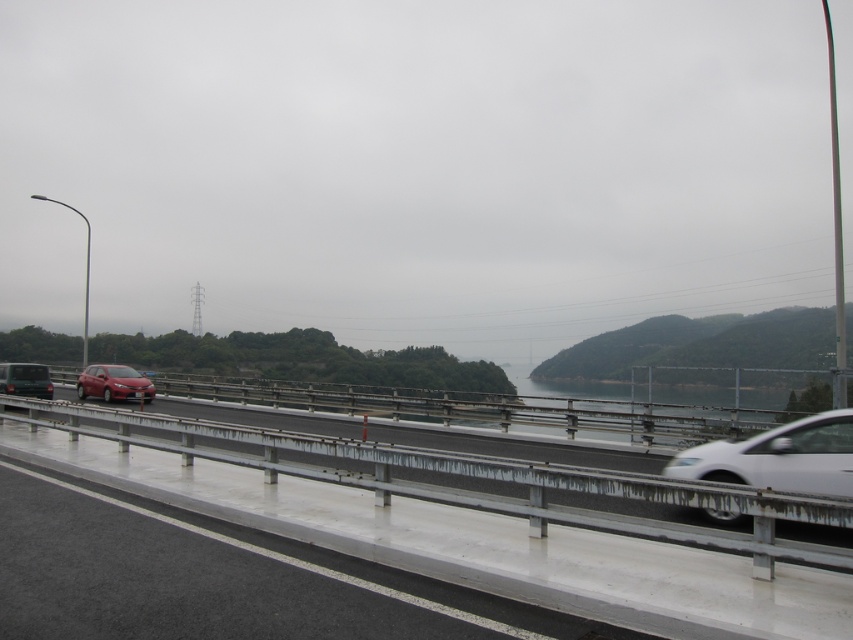
Question: Does white concrete barrier at center appear over shiny red sedan at center?

Choices:
 (A) no
 (B) yes

Answer: (B)

Question: Does white concrete barrier at center have a greater width compared to shiny red sedan at center?

Choices:
 (A) yes
 (B) no

Answer: (B)

Question: Which point is farther to the camera?

Choices:
 (A) matte black car at left
 (B) satin silver sedan at right
 (C) shiny red sedan at center

Answer: (C)

Question: Which point is farther from the camera taking this photo?

Choices:
 (A) (97, 380)
 (B) (810, 484)

Answer: (A)

Question: Which point is farther to the camera?

Choices:
 (A) (782, 595)
 (B) (711, 474)

Answer: (B)

Question: Where is white concrete barrier at center located in relation to shiny red sedan at center in the image?

Choices:
 (A) above
 (B) below

Answer: (A)